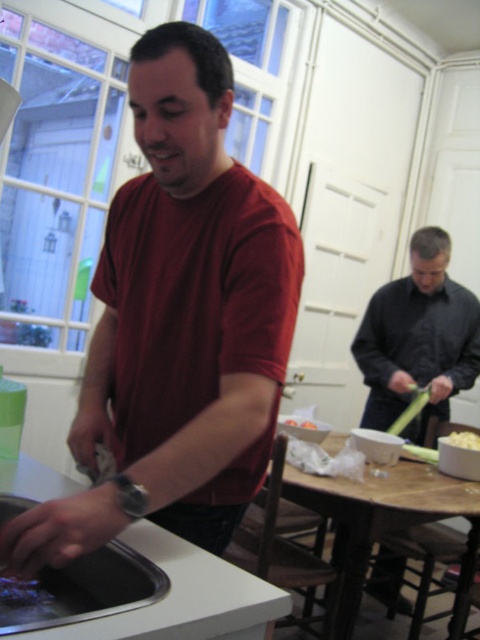
Question: Which point is farther from the camera taking this photo?

Choices:
 (A) (463, 435)
 (B) (170, 109)
 (C) (94, 554)
 (D) (427, 378)

Answer: (D)

Question: Which of the following is the closest to the observer?

Choices:
 (A) (399, 337)
 (B) (85, 464)
 (C) (456, 442)

Answer: (B)

Question: Is matte red shirt at center positioned behind white matte popcorn at center?

Choices:
 (A) yes
 (B) no

Answer: (B)

Question: Does dark gray shirt at right have a larger size compared to stainless steel sink at lower left?

Choices:
 (A) yes
 (B) no

Answer: (A)

Question: Which object is the closest to the white matte popcorn at center?

Choices:
 (A) dark gray shirt at right
 (B) matte red shirt at center

Answer: (A)

Question: Is dark gray shirt at right further to the viewer compared to white matte popcorn at center?

Choices:
 (A) no
 (B) yes

Answer: (B)